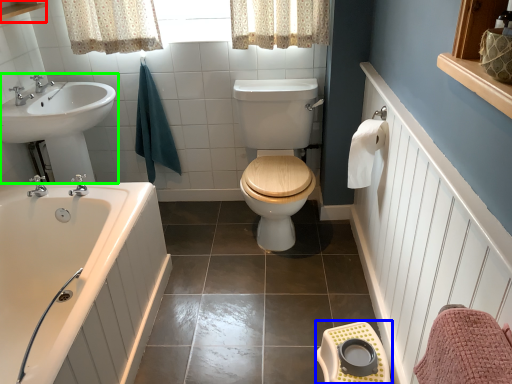
Question: Estimate the real-world distances between objects in this image. Which object is closer to balustrade (highlighted by a red box), step stool (highlighted by a blue box) or sink (highlighted by a green box)?

Choices:
 (A) step stool
 (B) sink

Answer: (B)